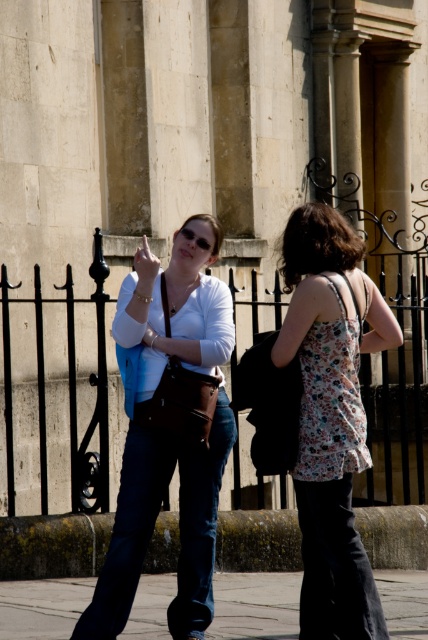
Who is more forward, [371,308] or [262,604]?

Point [262,604] is in front.

Based on the photo, does floral fabric tank top at center appear under concrete pavement at lower center?

Incorrect, floral fabric tank top at center is not positioned below concrete pavement at lower center.

Which is in front, point (309, 413) or point (386, 596)?

Positioned in front is point (309, 413).

What are the coordinates of `floral fabric tank top at center` in the screenshot? It's located at (332, 416).

Does dark blue denim jeans at center appear on the right side of concrete pavement at lower center?

In fact, dark blue denim jeans at center is to the left of concrete pavement at lower center.

Who is shorter, dark blue denim jeans at center or concrete pavement at lower center?

concrete pavement at lower center is shorter.

Is point (158, 448) behind point (76, 602)?

No, it is in front of (76, 602).

Locate an element on the screen. The height and width of the screenshot is (640, 428). dark blue denim jeans at center is located at coordinates (154, 522).

Is dark blue denim jeans at center below dark blue denim jeans at lower center?

Actually, dark blue denim jeans at center is above dark blue denim jeans at lower center.

Who is higher up, dark blue denim jeans at center or dark blue denim jeans at lower center?

dark blue denim jeans at center is above.

Between point (181, 608) and point (303, 596), which one is positioned in front?

Point (181, 608) is in front.

Where is `dark blue denim jeans at center`? The image size is (428, 640). dark blue denim jeans at center is located at coordinates (154, 522).